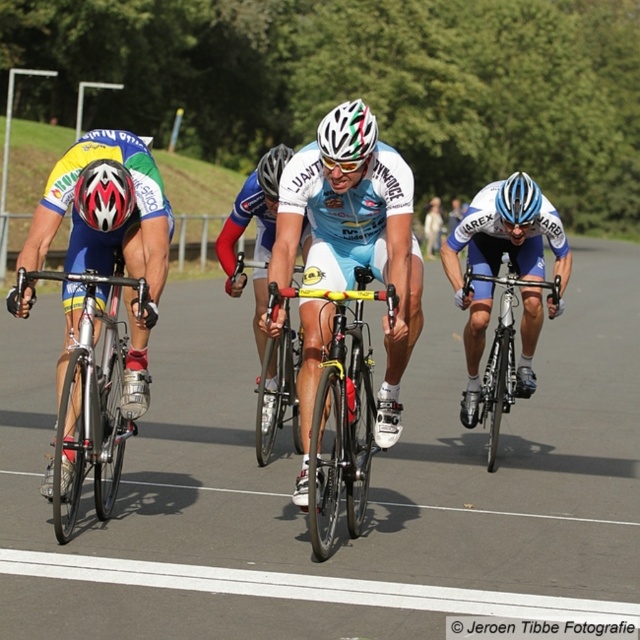
Question: Does matte black helmet at left appear on the left side of blue matte bicycle helmet at center?

Choices:
 (A) no
 (B) yes

Answer: (B)

Question: Is light blue fabric jersey at center wider than white glossy bicycle helmet at center?

Choices:
 (A) yes
 (B) no

Answer: (B)

Question: Based on their relative distances, which object is nearer to the white glossy bicycle helmet at center?

Choices:
 (A) blue and white jersey at center
 (B) matte black helmet at left
 (C) light blue fabric jersey at center
 (D) shiny metallic bicycle at center

Answer: (C)

Question: Based on their relative distances, which object is nearer to the white glossy bicycle helmet at center?

Choices:
 (A) shiny metallic bicycle at center
 (B) blue matte bicycle helmet at center

Answer: (A)

Question: Among these points, which one is nearest to the camera?

Choices:
 (A) (470, 404)
 (B) (276, 154)
 (C) (518, 182)
 (D) (524, 182)

Answer: (D)

Question: Can you confirm if matte black helmet at left is wider than white glossy bicycle helmet at center?

Choices:
 (A) yes
 (B) no

Answer: (A)